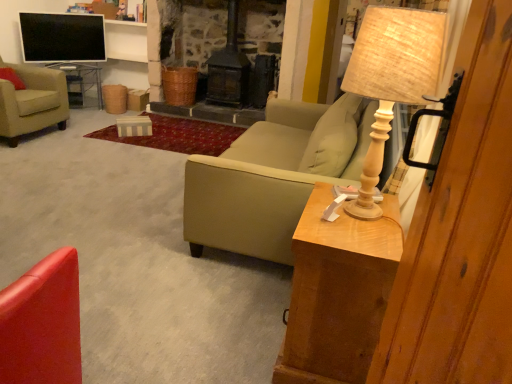
The image size is (512, 384). I want to click on unoccupied area in front of wooden beige table lamp at right, so [357, 233].